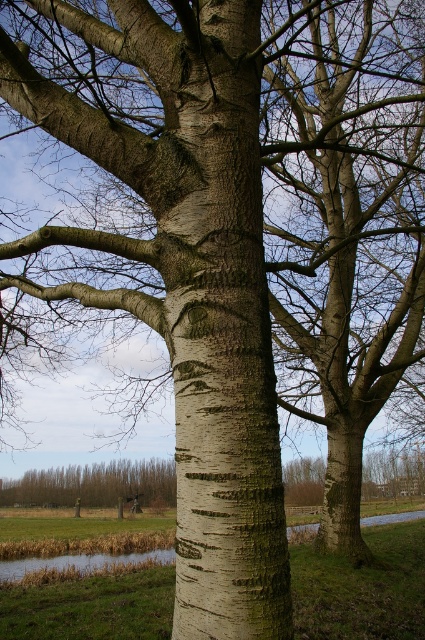
Question: Which of the following is the farthest from the observer?

Choices:
 (A) white bark tree trunk at center
 (B) brown rough bark tree at lower left

Answer: (B)

Question: Is white bark tree trunk at center to the left of brown rough bark tree at lower left from the viewer's perspective?

Choices:
 (A) no
 (B) yes

Answer: (A)

Question: Can you confirm if white bark tree trunk at center is positioned to the right of brown rough bark tree at lower left?

Choices:
 (A) yes
 (B) no

Answer: (A)

Question: Does white bark tree trunk at center come behind brown rough bark tree at lower left?

Choices:
 (A) no
 (B) yes

Answer: (A)

Question: Which object appears closest to the camera in this image?

Choices:
 (A) white bark tree trunk at center
 (B) brown rough bark tree at lower left

Answer: (A)